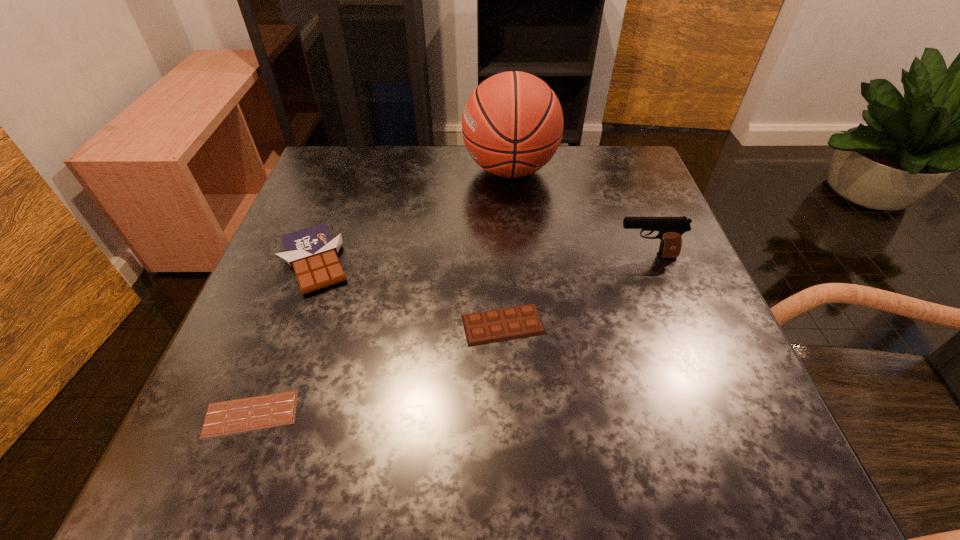
Locate an element on the screen. The height and width of the screenshot is (540, 960). object that is at the near edge is located at coordinates (254, 413).

You are a GUI agent. You are given a task and a screenshot of the screen. Output one action in this format:
    pyautogui.click(x=<x>, y=<y>)
    Task: Click on the object that is at the right edge
    
    Given the screenshot: What is the action you would take?
    671,229

Where is `object that is at the near left corner`? Image resolution: width=960 pixels, height=540 pixels. object that is at the near left corner is located at coordinates (254, 413).

In the image, there is a desktop. Identify the location of vacant space at the far edge. Image resolution: width=960 pixels, height=540 pixels. (430, 177).

Locate an element on the screen. The image size is (960, 540). vacant space at the near edge is located at coordinates (511, 426).

The image size is (960, 540). In order to click on vacant region at the left edge in this screenshot , I will do `click(344, 264)`.

This screenshot has width=960, height=540. In order to click on blank space at the right edge of the desktop in this screenshot , I will do `click(599, 207)`.

Locate an element on the screen. This screenshot has height=540, width=960. free space at the far left corner is located at coordinates (335, 192).

Where is `free region at the near left corner of the desktop`? free region at the near left corner of the desktop is located at coordinates (196, 431).

In the image, there is a desktop. In order to click on free space at the far right corner in this screenshot , I will do `click(584, 155)`.